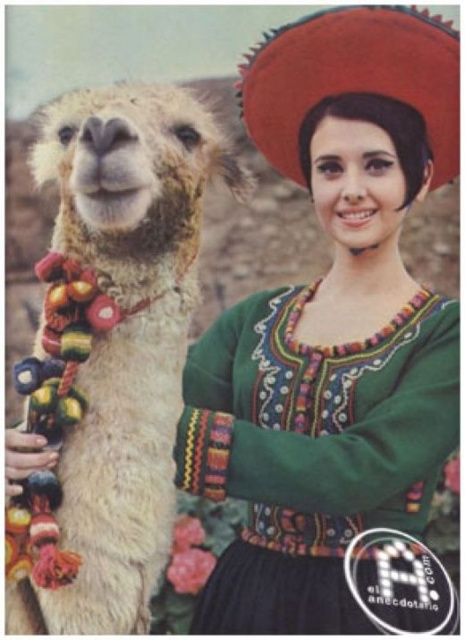
Question: Which point is farther to the camera?

Choices:
 (A) (374, 403)
 (B) (298, 26)

Answer: (B)

Question: Does fuzzy white alpaca at left appear over green embroidered dress at center?

Choices:
 (A) no
 (B) yes

Answer: (B)

Question: Which is nearer to the fuzzy white alpaca at left?

Choices:
 (A) green embroidered dress at center
 (B) red felt sombrero at upper right

Answer: (A)

Question: In this image, where is green embroidered dress at center located relative to red felt sombrero at upper right?

Choices:
 (A) below
 (B) above

Answer: (A)

Question: Can you confirm if fuzzy white alpaca at left is positioned to the right of green embroidered dress at center?

Choices:
 (A) no
 (B) yes

Answer: (A)

Question: Among these objects, which one is farthest from the camera?

Choices:
 (A) green embroidered dress at center
 (B) red felt sombrero at upper right

Answer: (B)